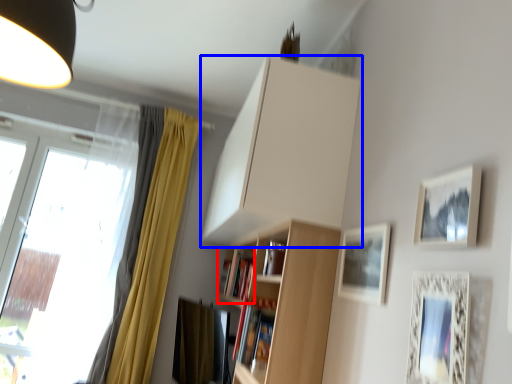
Question: Among these objects, which one is farthest to the camera, book (highlighted by a red box) or cabinetry (highlighted by a blue box)?

Choices:
 (A) book
 (B) cabinetry

Answer: (A)